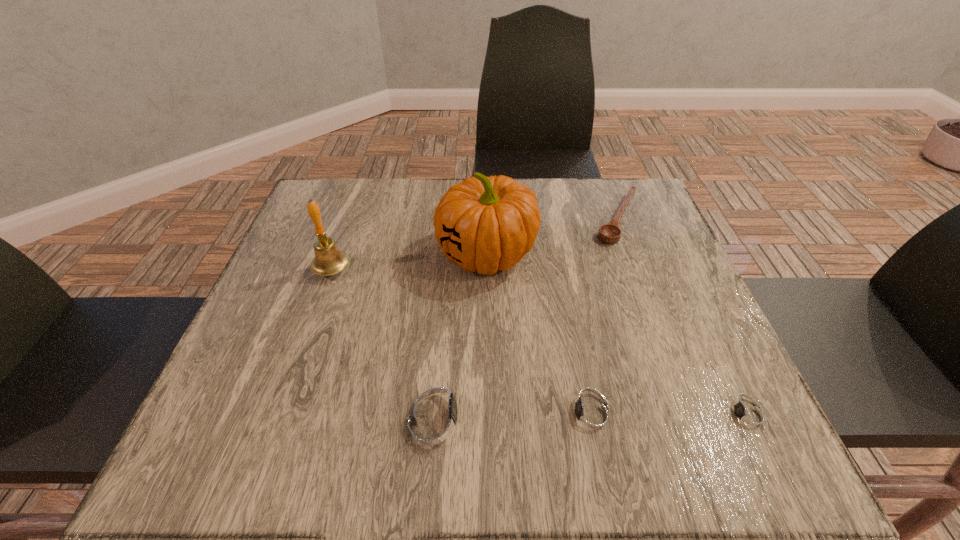
Identify the location of the leftmost watch. This screenshot has height=540, width=960. (436, 417).

The width and height of the screenshot is (960, 540). In order to click on the tallest watch in this screenshot , I will do `click(436, 417)`.

Identify the location of the second shortest watch. (591, 416).

Where is `the shortest object`? The image size is (960, 540). the shortest object is located at coordinates (747, 415).

The width and height of the screenshot is (960, 540). I want to click on the shortest watch, so click(747, 415).

Find the location of `wooden spoon`. wooden spoon is located at coordinates (610, 233).

The width and height of the screenshot is (960, 540). Identify the location of pumpkin. (484, 224).

I want to click on bell, so click(329, 260).

Locate an element on the screen. The width and height of the screenshot is (960, 540). vacant space situated 0.270m on the face of the leftmost watch is located at coordinates (654, 414).

Locate an element on the screen. The image size is (960, 540). free point located 0.310m on the face of the second shortest watch is located at coordinates (364, 415).